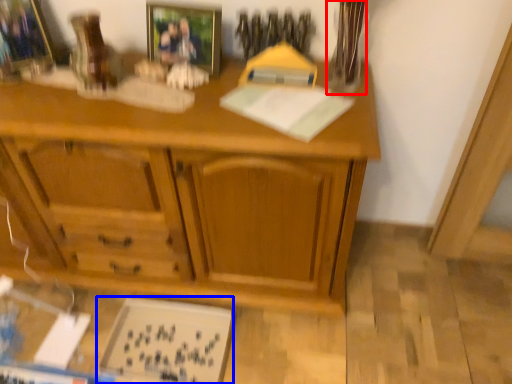
Question: Which of the following is the closest to the observer, glass vase (highlighted by a red box) or book (highlighted by a blue box)?

Choices:
 (A) glass vase
 (B) book

Answer: (A)